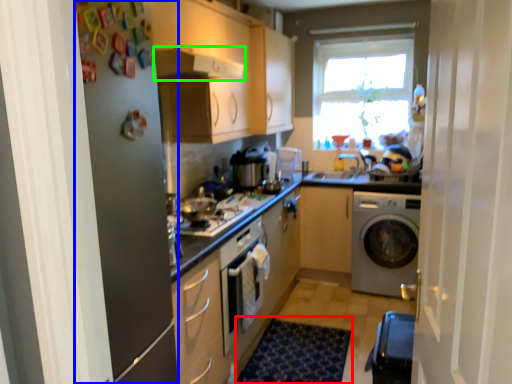
Question: Considering the real-world distances, which object is closest to doormat (highlighted by a red box)? screen door (highlighted by a blue box) or exhaust hood (highlighted by a green box).

Choices:
 (A) screen door
 (B) exhaust hood

Answer: (A)